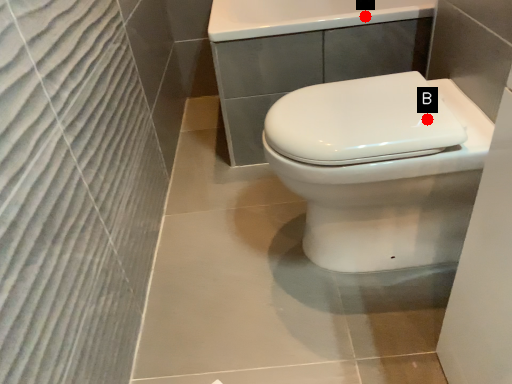
Question: Two points are circled on the image, labeled by A and B beside each circle. Which point is closer to the camera?

Choices:
 (A) A is closer
 (B) B is closer

Answer: (B)